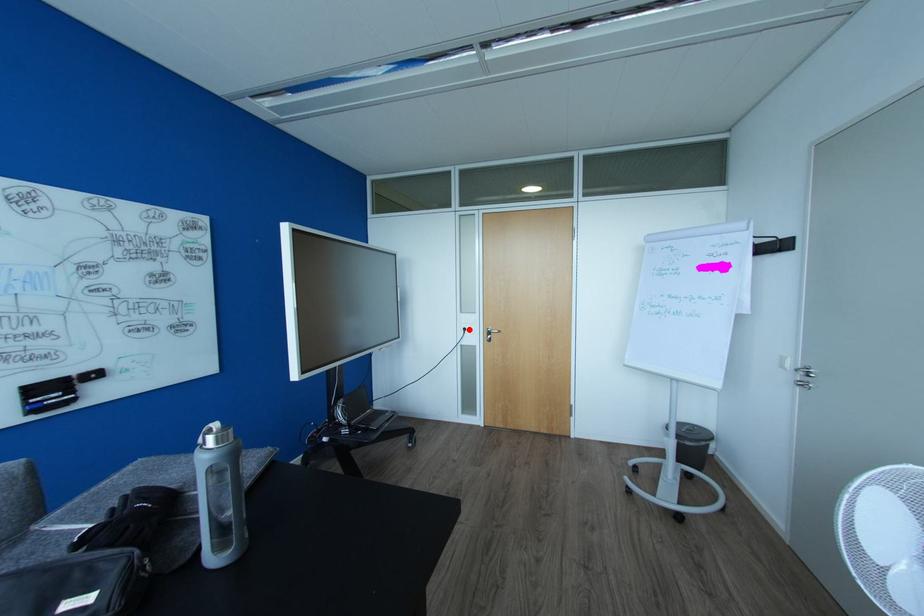
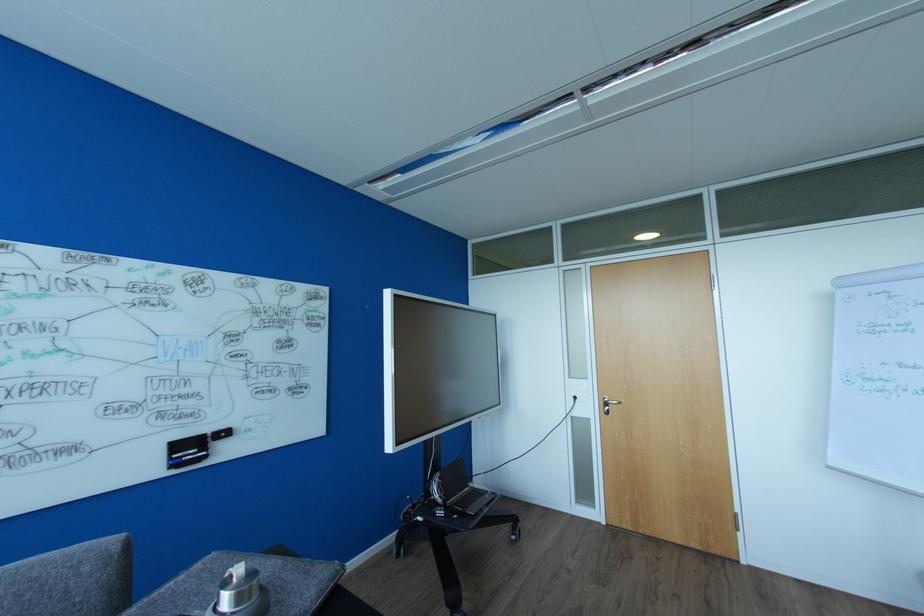
Question: A red point is marked in image1. In image2, is the corresponding 3D point closer to the camera or farther? Reply with the corresponding letter.

Choices:
 (A) The corresponding 3D point is closer.
 (B) The corresponding 3D point is farther.

Answer: (B)